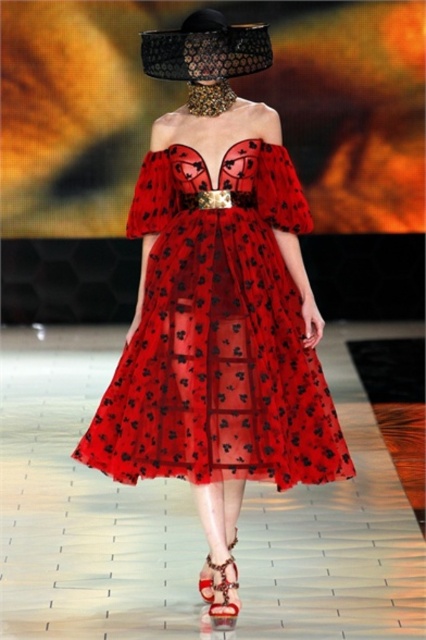
Question: Which point is farther to the camera?

Choices:
 (A) leather/textured sandal at lower center
 (B) translucent red dress at center

Answer: (B)

Question: Is translucent red dress at center behind leather/textured sandal at lower center?

Choices:
 (A) no
 (B) yes

Answer: (B)

Question: Can you confirm if translucent red dress at center is wider than leather/textured sandal at lower center?

Choices:
 (A) no
 (B) yes

Answer: (B)

Question: Which object is closer to the camera taking this photo?

Choices:
 (A) leather/textured sandal at lower center
 (B) translucent red dress at center

Answer: (A)

Question: Among these points, which one is farthest from the camera?

Choices:
 (A) (155, 458)
 (B) (221, 600)

Answer: (A)

Question: Can you confirm if translucent red dress at center is thinner than leather/textured sandal at lower center?

Choices:
 (A) yes
 (B) no

Answer: (B)